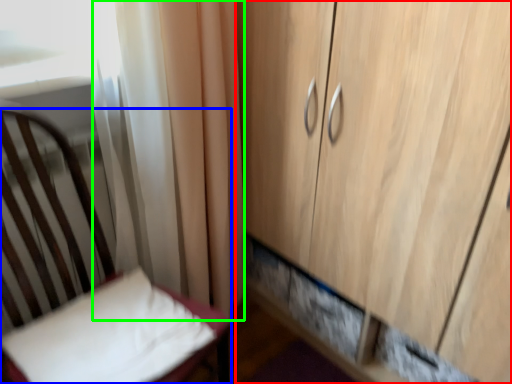
Question: Estimate the real-world distances between objects in this image. Which object is closer to cupboard (highlighted by a red box), furniture (highlighted by a blue box) or curtain (highlighted by a green box)?

Choices:
 (A) furniture
 (B) curtain

Answer: (B)